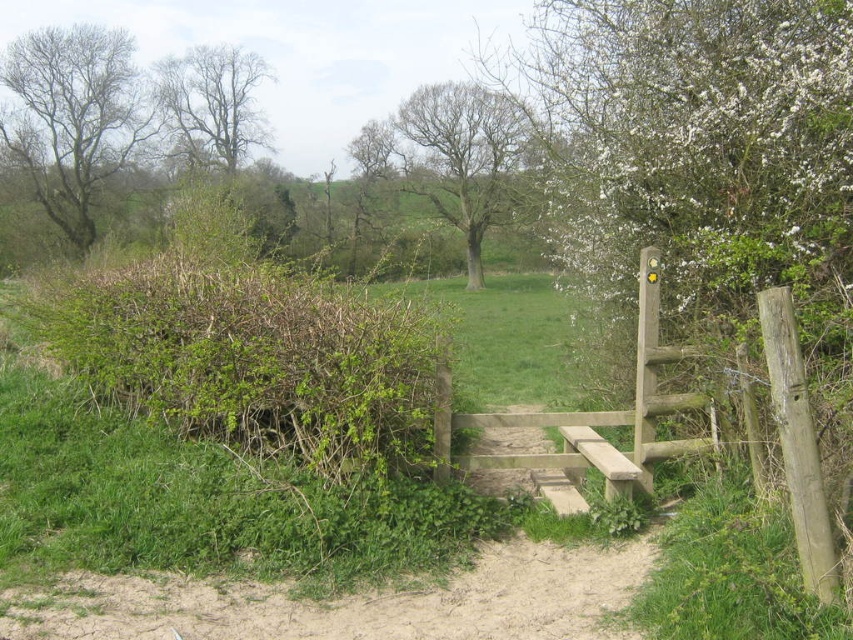
You are a gardener planning to prune the bare branches at left and the bare brown tree at center. Which one requires a taller ladder to reach its highest point?

The bare branches at left is taller than the bare brown tree at center, so you will need a taller ladder for the bare branches at left to reach its highest point.

You are planning to paint a rural landscape and need to choose between focusing on the bare brown tree at center and the bare branches tree at upper left. Which tree should you focus on if you want to depict a wider tree in your painting?

The bare brown tree at center is wider than the bare branches tree at upper left, so you should focus on the bare brown tree at center to depict a wider tree in your painting.